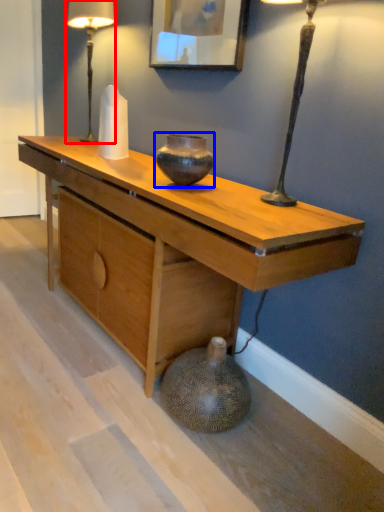
Question: Which of the following is the farthest to the observer, table lamp (highlighted by a red box) or vase (highlighted by a blue box)?

Choices:
 (A) table lamp
 (B) vase

Answer: (A)